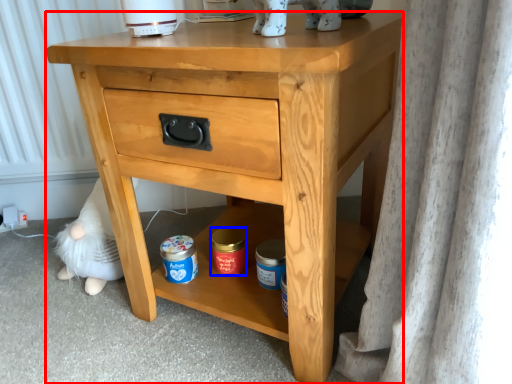
Question: Which object appears closest to the camera in this image, nightstand (highlighted by a red box) or pottery (highlighted by a blue box)?

Choices:
 (A) nightstand
 (B) pottery

Answer: (A)